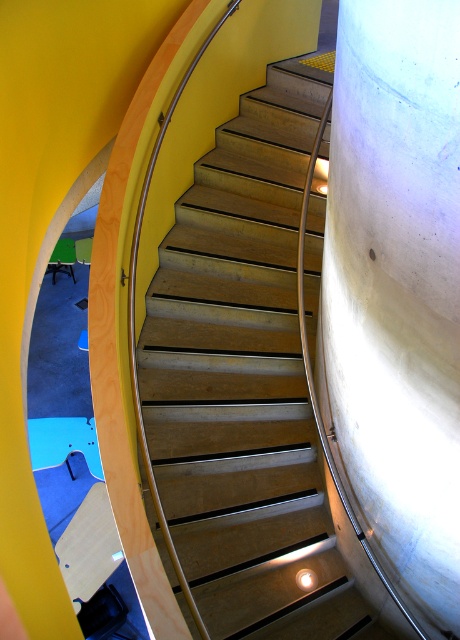
Looking at this image, you are an interior designer planning to place a new decorative sculpture between the wooden stairs at center and the white concrete pillar at right. Based on their sizes, which object should the sculpture be placed closer to for visual balance?

The wooden stairs at center is larger in size than the white concrete pillar at right, so the sculpture should be placed closer to the white concrete pillar at right to achieve visual balance.

You are standing at the bottom of the wooden stairs at center and want to walk towards the white concrete pillar at right. Which direction should you turn to reach it?

You should turn to your right because the white concrete pillar at right is located to the right side of the wooden stairs at center.

You are standing at the base of the curved staircase and want to determine which point is closer to you. The points are labeled as point 1 at coordinates point (176, 467) and point 2 at coordinates point (414, 404). Which point is closer to your current position?

Point 1 at coordinates point (176, 467) is closer to you because it is further to the viewer than point 2 at coordinates point (414, 404).